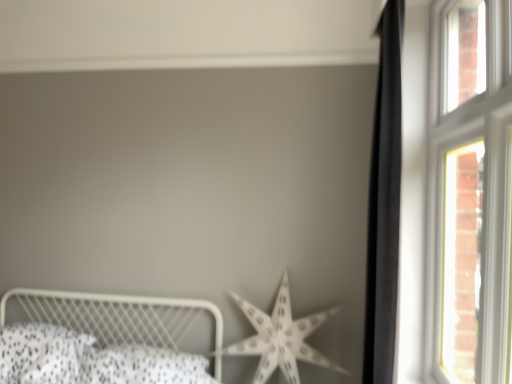
Question: Is black matte curtain at right looking in the opposite direction of white paper star at center?

Choices:
 (A) yes
 (B) no

Answer: (B)

Question: Is black matte curtain at right positioned beyond the bounds of white paper star at center?

Choices:
 (A) no
 (B) yes

Answer: (B)

Question: From a real-world perspective, is black matte curtain at right physically below white paper star at center?

Choices:
 (A) yes
 (B) no

Answer: (B)

Question: Can you confirm if black matte curtain at right is wider than white paper star at center?

Choices:
 (A) no
 (B) yes

Answer: (A)

Question: Considering the relative positions of black matte curtain at right and white paper star at center in the image provided, is black matte curtain at right to the right of white paper star at center from the viewer's perspective?

Choices:
 (A) yes
 (B) no

Answer: (A)

Question: Is black matte curtain at right not close to white paper star at center?

Choices:
 (A) no
 (B) yes

Answer: (A)

Question: Considering the relative sizes of black matte curtain at right and white metal bed at lower left in the image provided, is black matte curtain at right thinner than white metal bed at lower left?

Choices:
 (A) no
 (B) yes

Answer: (B)

Question: From a real-world perspective, is black matte curtain at right positioned under white metal bed at lower left based on gravity?

Choices:
 (A) yes
 (B) no

Answer: (B)

Question: Is black matte curtain at right oriented away from white metal bed at lower left?

Choices:
 (A) no
 (B) yes

Answer: (A)

Question: Does black matte curtain at right appear on the right side of white metal bed at lower left?

Choices:
 (A) no
 (B) yes

Answer: (B)

Question: Could you tell me if black matte curtain at right is facing white metal bed at lower left?

Choices:
 (A) no
 (B) yes

Answer: (B)

Question: Considering the relative sizes of black matte curtain at right and white metal bed at lower left in the image provided, is black matte curtain at right taller than white metal bed at lower left?

Choices:
 (A) no
 (B) yes

Answer: (B)

Question: Is white metal bed at lower left far away from black matte curtain at right?

Choices:
 (A) no
 (B) yes

Answer: (B)